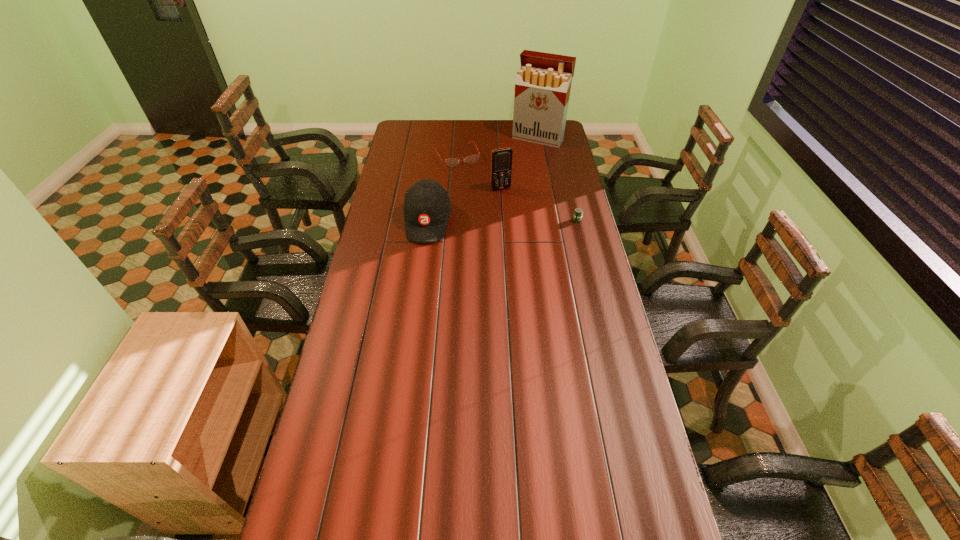
Locate an element on the screen. This screenshot has width=960, height=540. cigarette case situated at the right edge is located at coordinates (543, 83).

Locate an element on the screen. object at the far right corner is located at coordinates (543, 83).

Locate an element on the screen. This screenshot has height=540, width=960. free space at the far edge of the desktop is located at coordinates (498, 136).

I want to click on vacant space at the near edge of the desktop, so click(x=544, y=488).

Where is `free space at the left edge of the desktop`? This screenshot has width=960, height=540. free space at the left edge of the desktop is located at coordinates (381, 218).

Where is `free region at the right edge`? free region at the right edge is located at coordinates (574, 246).

Find the location of a particular element. Image resolution: width=960 pixels, height=540 pixels. empty location between the beer can and the cellular telephone is located at coordinates (539, 205).

Identify the location of free space that is in between the tallest object and the cellular telephone. This screenshot has width=960, height=540. (519, 164).

Find the location of a particular element. The width and height of the screenshot is (960, 540). vacant area that lies between the cellular telephone and the beer can is located at coordinates (539, 205).

Identify the location of free point between the spectacles and the cigarette case. (498, 147).